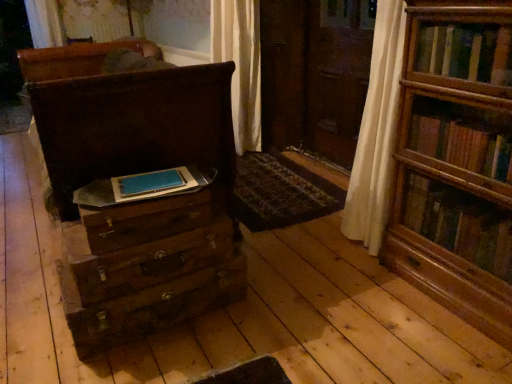
Question: Is wooden drawer at lower left, the 1th drawer when ordered from top to bottom, not inside wooden bookshelf at right?

Choices:
 (A) yes
 (B) no

Answer: (A)

Question: Does wooden drawer at lower left, which appears as the third drawer when ordered from the bottom, come behind wooden bookshelf at right?

Choices:
 (A) yes
 (B) no

Answer: (A)

Question: Does wooden drawer at lower left, which appears as the third drawer when ordered from the bottom, appear on the right side of wooden bookshelf at right?

Choices:
 (A) yes
 (B) no

Answer: (B)

Question: From a real-world perspective, is wooden drawer at lower left, the 1th drawer when ordered from top to bottom, located beneath wooden bookshelf at right?

Choices:
 (A) yes
 (B) no

Answer: (A)

Question: Considering the relative sizes of wooden drawer at lower left, the 1th drawer when ordered from top to bottom, and wooden bookshelf at right in the image provided, is wooden drawer at lower left, the 1th drawer when ordered from top to bottom, wider than wooden bookshelf at right?

Choices:
 (A) no
 (B) yes

Answer: (B)

Question: In the image, is patterned carpet at center on the left side or the right side of wooden bookshelf at right?

Choices:
 (A) left
 (B) right

Answer: (A)

Question: Is point (309, 190) closer or farther from the camera than point (449, 21)?

Choices:
 (A) closer
 (B) farther

Answer: (B)

Question: From a real-world perspective, is patterned carpet at center above or below wooden bookshelf at right?

Choices:
 (A) below
 (B) above

Answer: (A)

Question: Choose the correct answer: Is patterned carpet at center inside wooden bookshelf at right or outside it?

Choices:
 (A) inside
 (B) outside

Answer: (B)

Question: Is matte brown chest of drawers at left spatially inside patterned carpet at center, or outside of it?

Choices:
 (A) inside
 (B) outside

Answer: (B)

Question: From their relative heights in the image, would you say matte brown chest of drawers at left is taller or shorter than patterned carpet at center?

Choices:
 (A) tall
 (B) short

Answer: (A)

Question: In the image, is matte brown chest of drawers at left positioned in front of or behind patterned carpet at center?

Choices:
 (A) behind
 (B) front

Answer: (B)

Question: From a real-world perspective, is matte brown chest of drawers at left above or below patterned carpet at center?

Choices:
 (A) below
 (B) above

Answer: (B)

Question: Would you say wooden bookshelf at right is to the left or to the right of blue matte paper at center in the picture?

Choices:
 (A) right
 (B) left

Answer: (A)

Question: Would you say wooden bookshelf at right is inside or outside blue matte paper at center?

Choices:
 (A) inside
 (B) outside

Answer: (B)